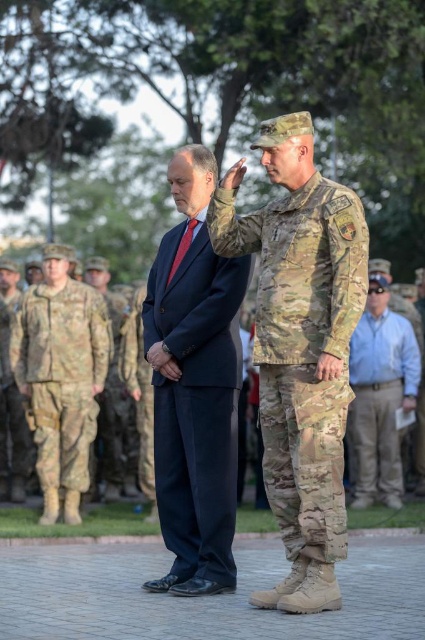
Question: Can you confirm if camo fabric uniform at right is positioned to the right of camouflage uniform at center?

Choices:
 (A) yes
 (B) no

Answer: (A)

Question: Which of the following is the farthest from the observer?

Choices:
 (A) (121, 312)
 (B) (25, 348)
 (C) (379, 451)

Answer: (A)

Question: Is camo fabric uniform at right above camouflage fabric pants at center?

Choices:
 (A) yes
 (B) no

Answer: (A)

Question: Is camo fabric uniform at right positioned behind navy blue suit at center?

Choices:
 (A) yes
 (B) no

Answer: (B)

Question: Which object is closer to the camera taking this photo?

Choices:
 (A) navy blue suit at center
 (B) camouflage uniform at center

Answer: (A)

Question: Which object is positioned farthest from the blue shirt at center?

Choices:
 (A) camo fabric uniform at right
 (B) camouflage uniform at center
 (C) camouflage fabric pants at center

Answer: (A)